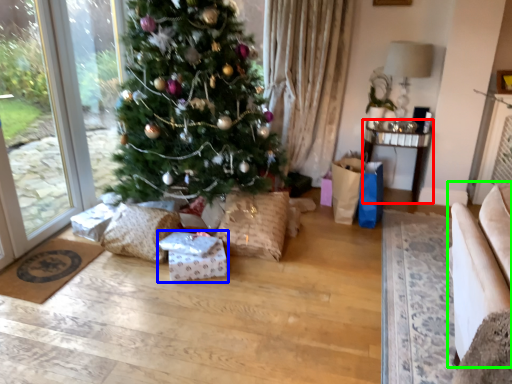
Question: Considering the real-world distances, which object is closest to table (highlighted by a red box)? package (highlighted by a blue box) or armchair (highlighted by a green box).

Choices:
 (A) package
 (B) armchair

Answer: (A)